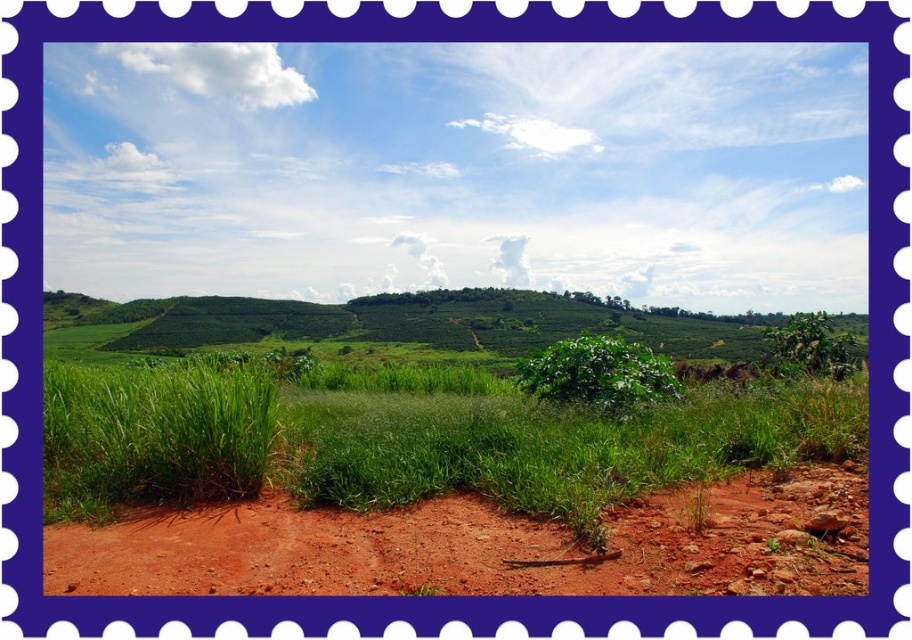
You are a gardener who needs to mow the lawn. You see the green leafy grass at center and the green leafy bush at center. Which one should you mow first based on their height?

The green leafy grass at center is taller than the green leafy bush at center, so you should mow the green leafy grass at center first.

You are standing at the top of the green grassy hillside at center and want to walk to the green leafy bush at center. Which direction should you move to reach it?

You should move to your right because the green grassy hillside at center is to the left of the green leafy bush at center, so moving right will take you towards it.